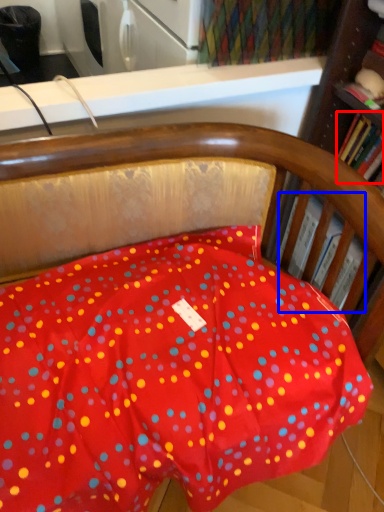
Question: Among these objects, which one is nearest to the camera, book (highlighted by a red box) or book (highlighted by a blue box)?

Choices:
 (A) book
 (B) book

Answer: (A)